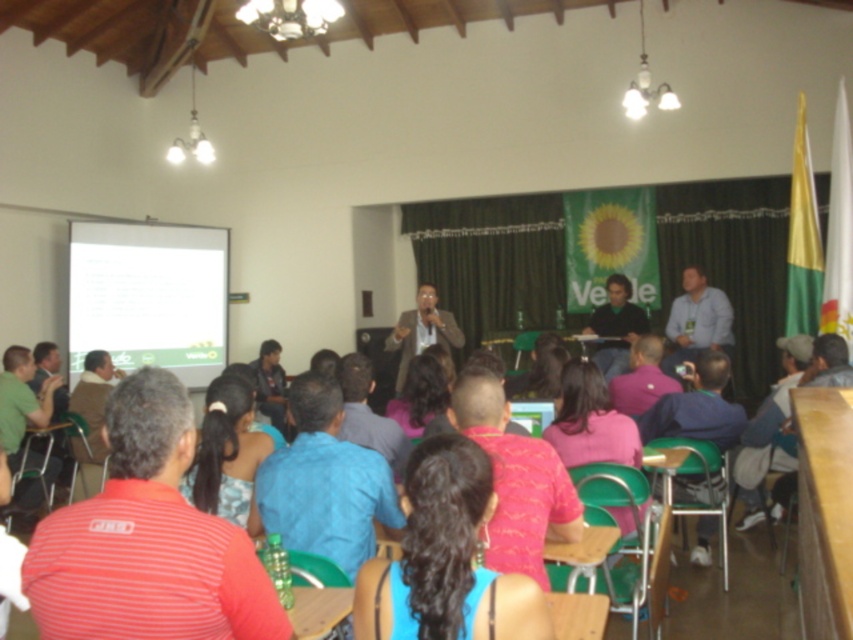
You are a photographer positioned at the back of the room. You need to capture a photo where both the white matte projection screen at left and the blue fabric shirt at center are clearly visible. Considering their heights, which object will appear taller in the photo?

The white matte projection screen at left will appear taller in the photo because it has a greater height compared to the blue fabric shirt at center.

You are an event organizer who needs to ensure that the blue fabric hair at center and the blue shirt at center are visible to the camera positioned at the back of the room. Which of these two items is more likely to be obscured by the other?

The blue fabric hair at center has a lesser height compared to the blue shirt at center, so the blue fabric hair at center is more likely to be obscured by the blue shirt at center.